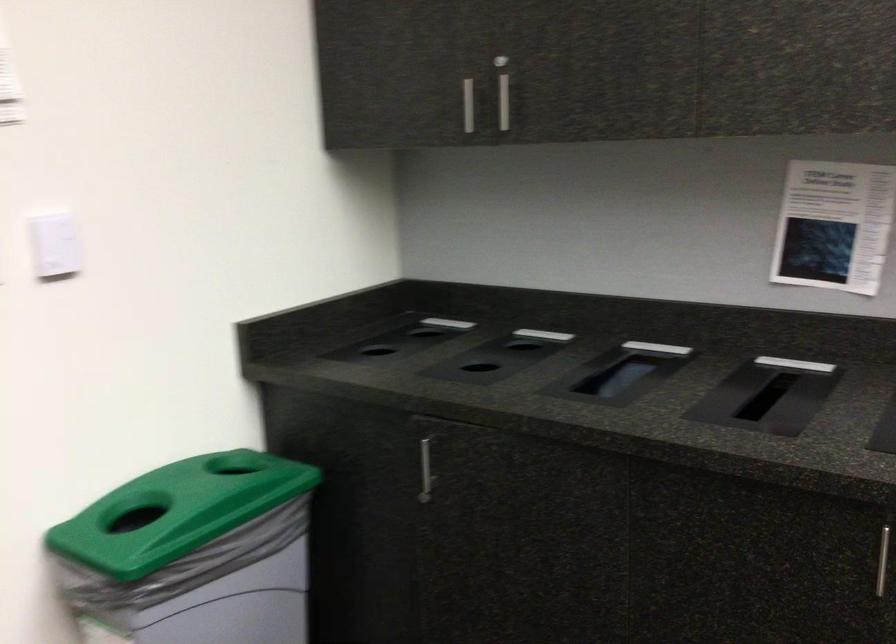
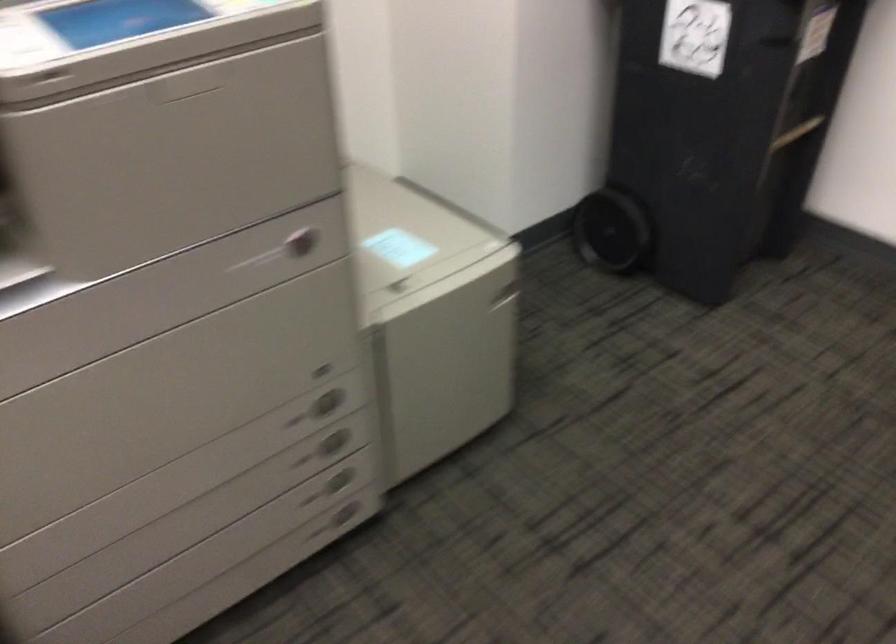
How did the camera likely rotate?

The camera rotated toward left-down.